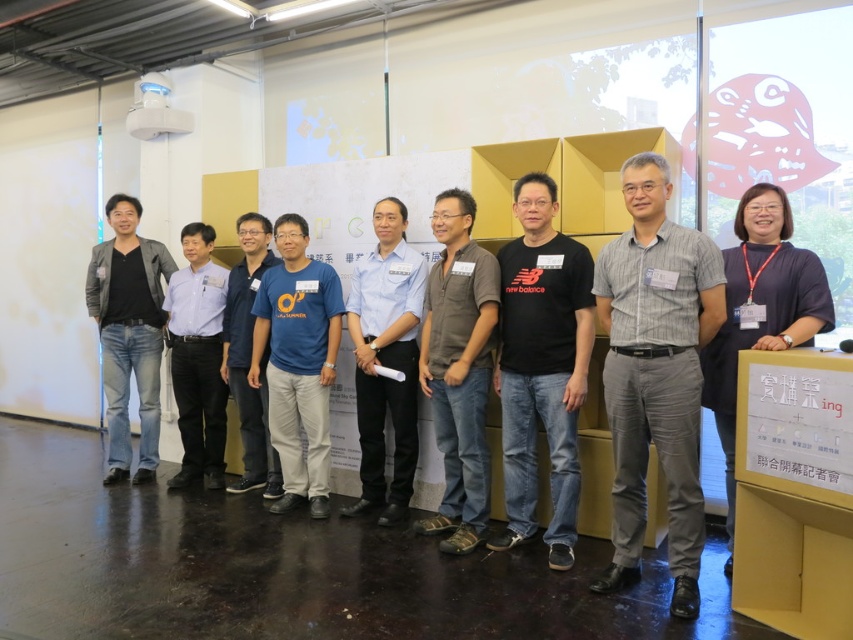
Question: Is black matte t-shirt at center positioned behind brown cotton shirt at center?

Choices:
 (A) yes
 (B) no

Answer: (B)

Question: Can you confirm if denim jeans at left is bigger than light blue shirt at center?

Choices:
 (A) no
 (B) yes

Answer: (B)

Question: Is blue uniform shirt at center positioned at the back of blue t-shirt at center?

Choices:
 (A) no
 (B) yes

Answer: (A)

Question: Which of the following is the closest to the observer?

Choices:
 (A) light blue shirt at center
 (B) gray striped shirt at center
 (C) blue t-shirt at center

Answer: (B)

Question: Which is nearer to the brown cotton shirt at center?

Choices:
 (A) black matte t-shirt at center
 (B) blue cotton t-shirt at center

Answer: (A)

Question: Which of the following is the farthest from the observer?

Choices:
 (A) gray striped shirt at center
 (B) purple fabric shirt at right

Answer: (B)